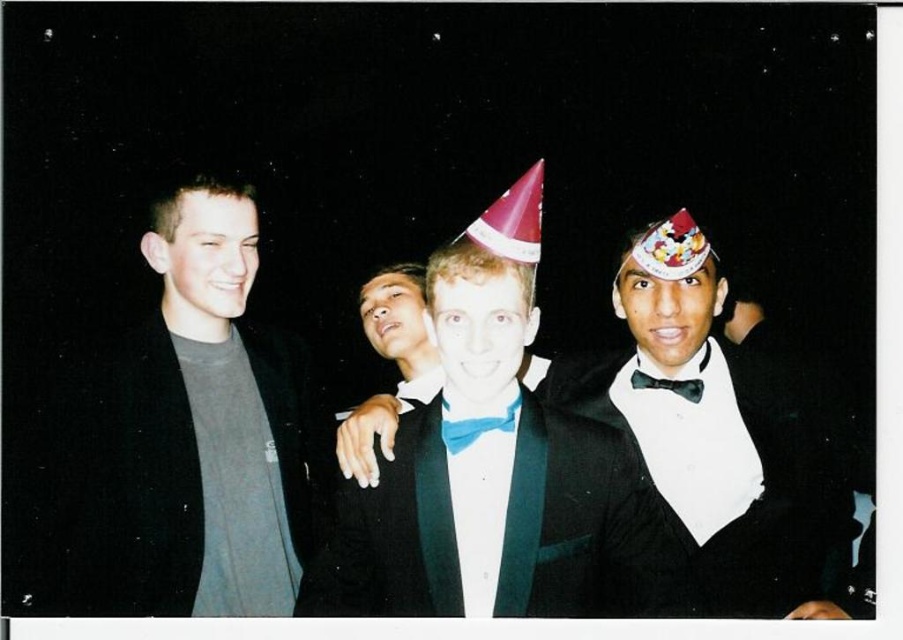
You are standing in front of the group photo and want to place a sticker exactly at the point with coordinates point [198,436]. Which object in the photo will the sticker land on?

The sticker will land on the gray cotton t shirt at left because the point [198,436] is located on it according to the description.